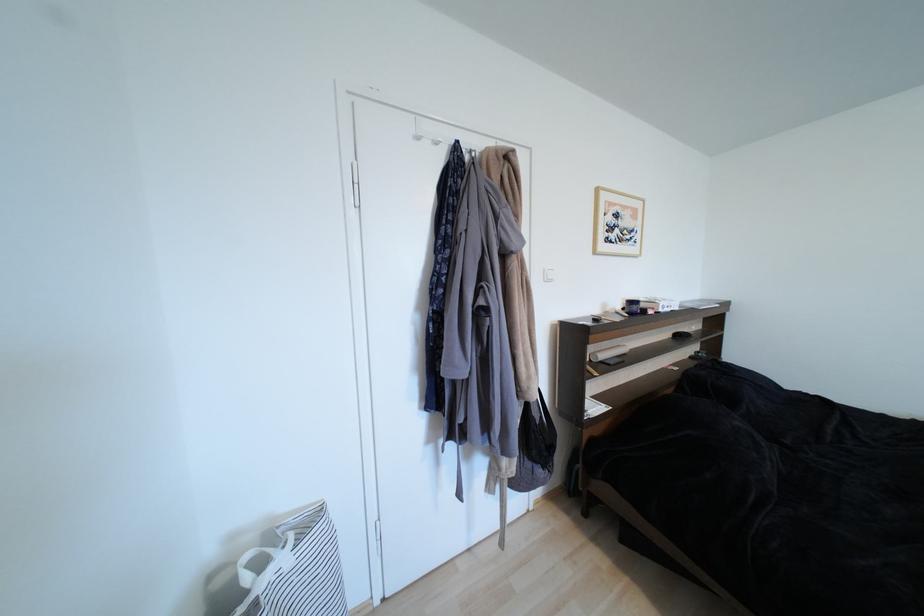
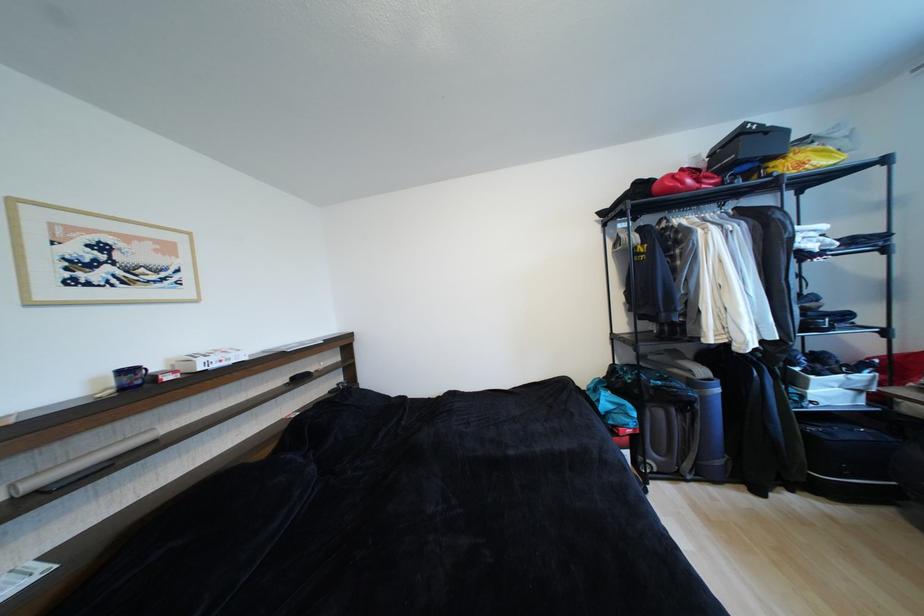
Question: I am providing you with two images of the same scene from different viewpoints. Which of the following objects are not visible in image2?

Choices:
 (A) blue yoga mat
 (B) white game box
 (C) blue mug
 (D) none of these

Answer: (D)